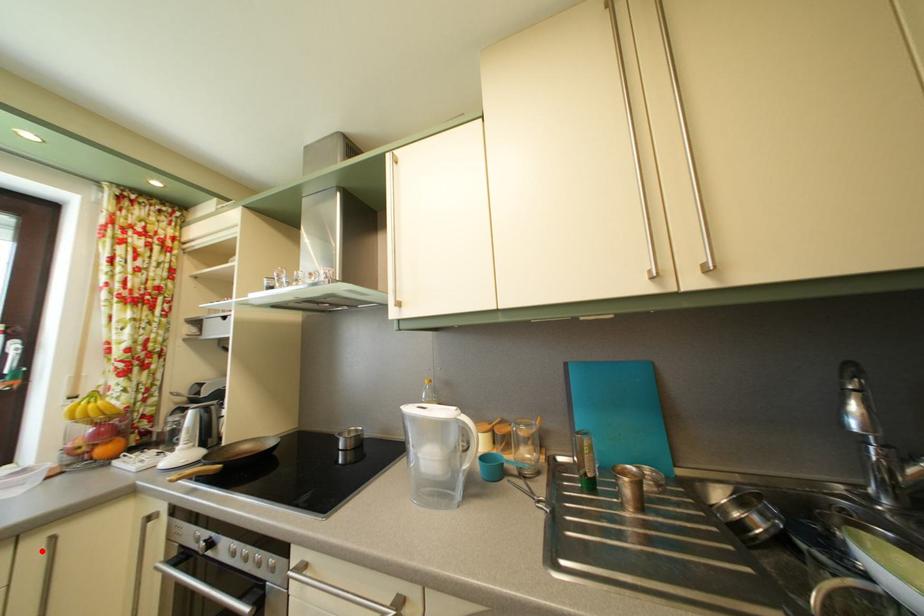
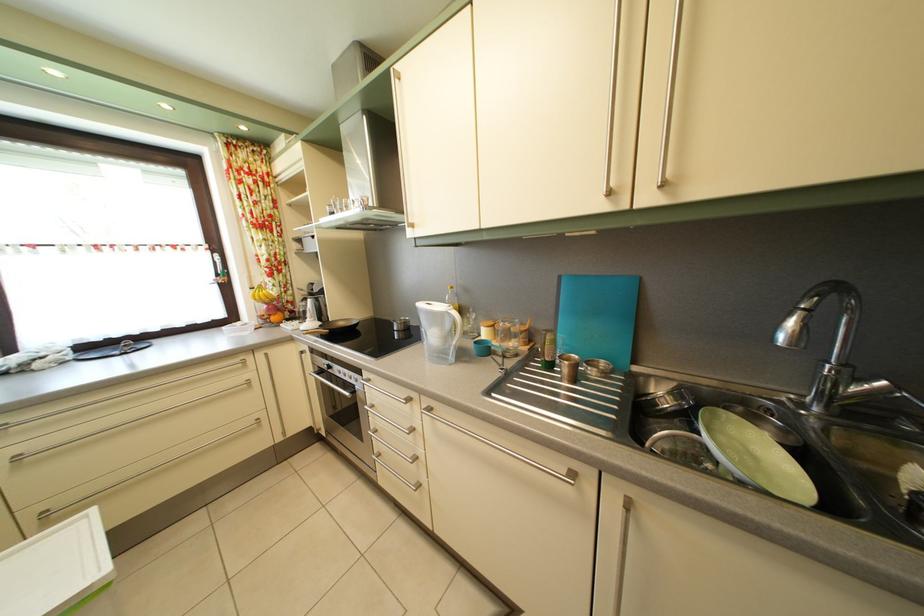
Find the pixel in the second image that matches the highlighted location in the first image.

(268, 363)